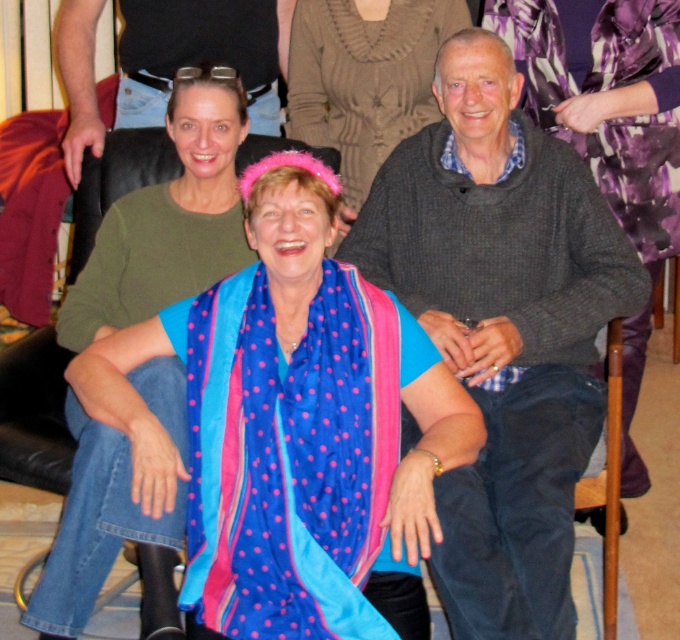
You are organizing a charity clothing drive and need to determine which item takes up more space in the donation box. Based on the image, which item is larger in size between the knitted gray sweater at center and the blue silk scarf at center?

The knitted gray sweater at center has a larger size compared to the blue silk scarf at center, so the sweater takes up more space in the donation box.

What are the exact coordinates of the blue silk scarf at center?

The blue silk scarf at center is located at coordinates point (x=309, y=422).